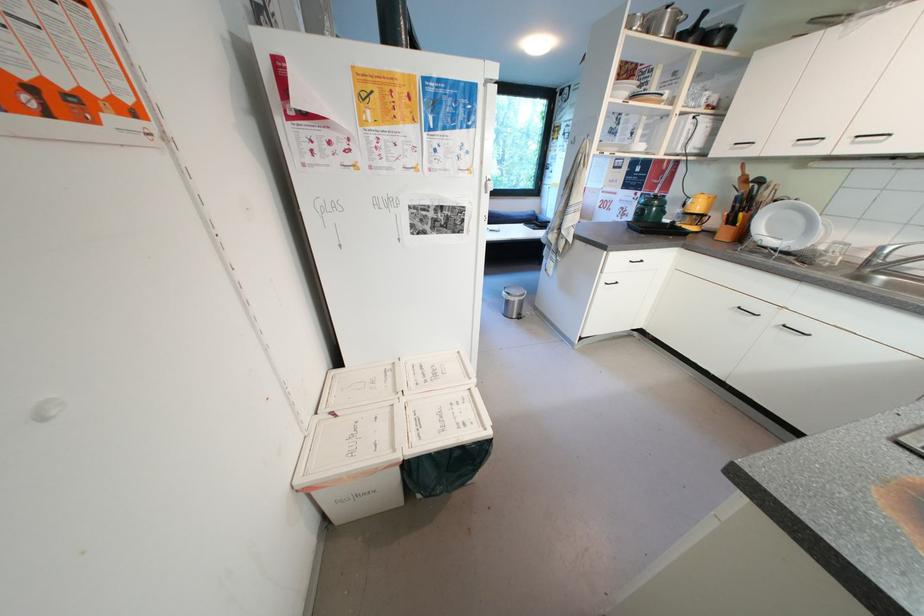
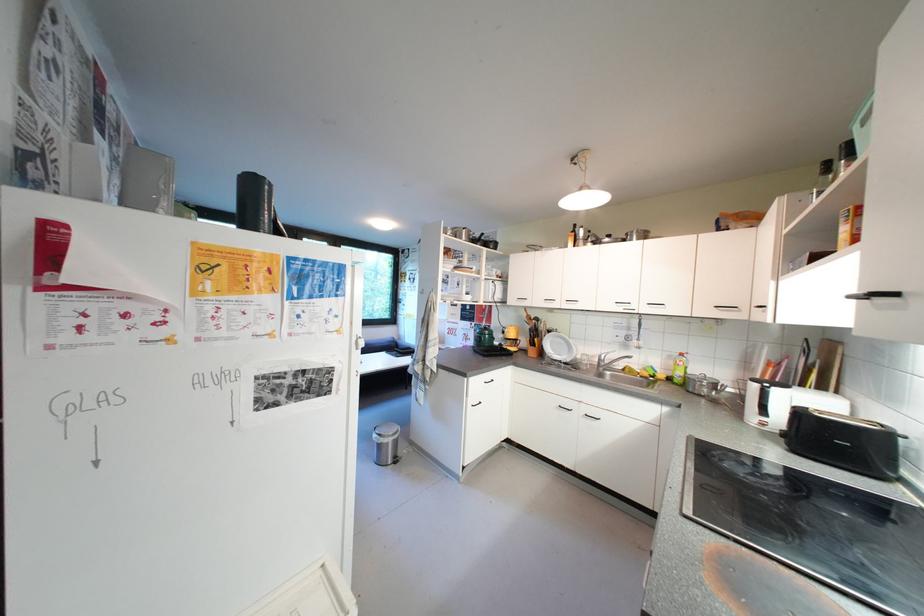
The point at [512,294] is marked in the first image. Where is the corresponding point in the second image?

(383, 438)